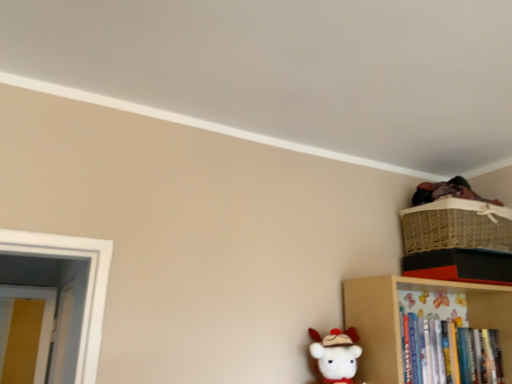
Where is `white plush toy at lower center`? Image resolution: width=512 pixels, height=384 pixels. white plush toy at lower center is located at coordinates (336, 354).

Identify the location of white plush toy at lower center. This screenshot has height=384, width=512. (336, 354).

In order to click on basket above the wooden bookshelf at lower right (from a real-world perspective) in this screenshot , I will do `click(456, 226)`.

In the image, is woven straw basket at upper right positioned in front of or behind wooden bookshelf at lower right?

Clearly, woven straw basket at upper right is behind wooden bookshelf at lower right.

Considering the sizes of objects woven straw basket at upper right and wooden bookshelf at lower right in the image provided, who is thinner, woven straw basket at upper right or wooden bookshelf at lower right?

With smaller width is wooden bookshelf at lower right.

From a real-world perspective, does woven straw basket at upper right stand above wooden bookshelf at lower right?

Yes.

Can you tell me how much white plush toy at lower center and wooden bookshelf at lower right differ in facing direction?

The facing directions of white plush toy at lower center and wooden bookshelf at lower right are 2.46 degrees apart.

Would you say white plush toy at lower center is inside or outside wooden bookshelf at lower right?

white plush toy at lower center cannot be found inside wooden bookshelf at lower right.

From a real-world perspective, which is physically below, white plush toy at lower center or wooden bookshelf at lower right?

white plush toy at lower center is physically lower.

Is white plush toy at lower center taller or shorter than wooden bookshelf at lower right?

white plush toy at lower center is shorter than wooden bookshelf at lower right.

Is woven straw basket at upper right not within white plush toy at lower center?

Yes, woven straw basket at upper right is not within white plush toy at lower center.

From the image's perspective, which is below, woven straw basket at upper right or white plush toy at lower center?

white plush toy at lower center.

Is point (417, 234) in front of point (352, 375)?

No.

From a real-world perspective, is woven straw basket at upper right located beneath white plush toy at lower center?

No, from a real-world perspective, woven straw basket at upper right is not beneath white plush toy at lower center.

Who is bigger, wooden bookshelf at lower right or white plush toy at lower center?

Bigger between the two is wooden bookshelf at lower right.

Is wooden bookshelf at lower right positioned behind white plush toy at lower center?

Yes, wooden bookshelf at lower right is behind white plush toy at lower center.

Can we say wooden bookshelf at lower right lies outside white plush toy at lower center?

Yes.

From the image's perspective, which is above, wooden bookshelf at lower right or white plush toy at lower center?

white plush toy at lower center is shown above in the image.

Does white plush toy at lower center lie behind woven straw basket at upper right?

No, white plush toy at lower center is closer to the camera.

Is white plush toy at lower center completely or partially outside of woven straw basket at upper right?

Absolutely, white plush toy at lower center is external to woven straw basket at upper right.

Measure the distance between white plush toy at lower center and woven straw basket at upper right.

white plush toy at lower center and woven straw basket at upper right are 22.29 inches apart.

Where is `toy below the woven straw basket at upper right (from the image's perspective)`? The image size is (512, 384). toy below the woven straw basket at upper right (from the image's perspective) is located at coordinates (336, 354).

Is wooden bookshelf at lower right looking in the opposite direction of woven straw basket at upper right?

No, woven straw basket at upper right is not at the back of wooden bookshelf at lower right.

Does wooden bookshelf at lower right have a smaller size compared to woven straw basket at upper right?

Actually, wooden bookshelf at lower right might be larger than woven straw basket at upper right.

Is wooden bookshelf at lower right at the left side of woven straw basket at upper right?

Indeed, wooden bookshelf at lower right is positioned on the left side of woven straw basket at upper right.

How many degrees apart are the facing directions of wooden bookshelf at lower right and woven straw basket at upper right?

They differ by 2.45 degrees in their facing directions.

This screenshot has height=384, width=512. I want to click on basket that is behind the wooden bookshelf at lower right, so click(x=456, y=226).

The height and width of the screenshot is (384, 512). What are the coordinates of `shelf above the white plush toy at lower center (from a real-world perspective)` in the screenshot? It's located at (398, 320).

Estimate the real-world distances between objects in this image. Which object is further from white plush toy at lower center, wooden bookshelf at lower right or woven straw basket at upper right?

The object further to white plush toy at lower center is woven straw basket at upper right.

Looking at the image, which one is located closer to wooden bookshelf at lower right, white plush toy at lower center or woven straw basket at upper right?

white plush toy at lower center is closer to wooden bookshelf at lower right.

When comparing their distances from wooden bookshelf at lower right, does woven straw basket at upper right or white plush toy at lower center seem closer?

white plush toy at lower center lies closer to wooden bookshelf at lower right than the other object.

Considering their positions, is woven straw basket at upper right positioned closer to white plush toy at lower center than wooden bookshelf at lower right?

Among the two, wooden bookshelf at lower right is located nearer to white plush toy at lower center.

Based on the photo, considering their positions, is wooden bookshelf at lower right positioned further to woven straw basket at upper right than white plush toy at lower center?

white plush toy at lower center is further to woven straw basket at upper right.

Looking at the image, which one is located further to woven straw basket at upper right, white plush toy at lower center or wooden bookshelf at lower right?

white plush toy at lower center is positioned further to the anchor woven straw basket at upper right.

Locate an element on the screen. shelf situated between white plush toy at lower center and woven straw basket at upper right from left to right is located at coordinates (398, 320).